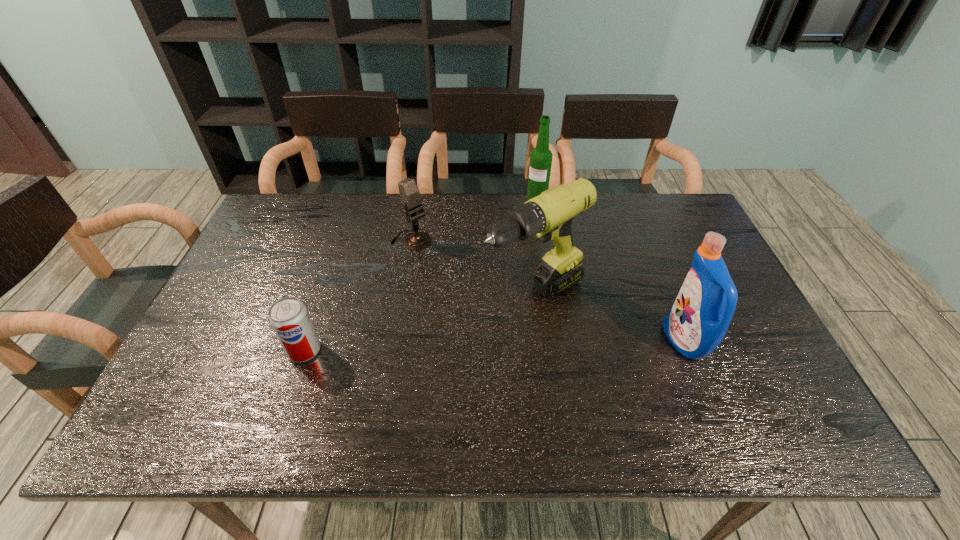
Identify the location of blank space located 0.220m on the label of the detergent. The width and height of the screenshot is (960, 540). (578, 341).

Where is `blank area located 0.400m on the handle side of the drill`? This screenshot has height=540, width=960. blank area located 0.400m on the handle side of the drill is located at coordinates (354, 398).

At what (x,y) coordinates should I click in order to perform the action: click on vacant point located on the handle side of the drill. Please return your answer as a coordinate pair (x, y). The height and width of the screenshot is (540, 960). Looking at the image, I should click on (362, 393).

Locate an element on the screen. vacant space located 0.340m on the handle side of the drill is located at coordinates pyautogui.click(x=378, y=384).

The width and height of the screenshot is (960, 540). Identify the location of vacant space situated on the front-facing side of the second farthest object. (448, 268).

Where is `vacant space located 0.320m on the front-facing side of the second farthest object`? This screenshot has width=960, height=540. vacant space located 0.320m on the front-facing side of the second farthest object is located at coordinates (495, 308).

Find the location of a particular element. free point located on the front-facing side of the second farthest object is located at coordinates (455, 274).

Find the location of a particular element. The height and width of the screenshot is (540, 960). blank area located on the label of the beer bottle is located at coordinates (505, 268).

At what (x,y) coordinates should I click in order to perform the action: click on vacant area located on the label of the beer bottle. Please return your answer as a coordinate pair (x, y). The height and width of the screenshot is (540, 960). Looking at the image, I should click on [527, 220].

Identify the location of vacant area situated 0.200m on the label of the beer bottle. (517, 240).